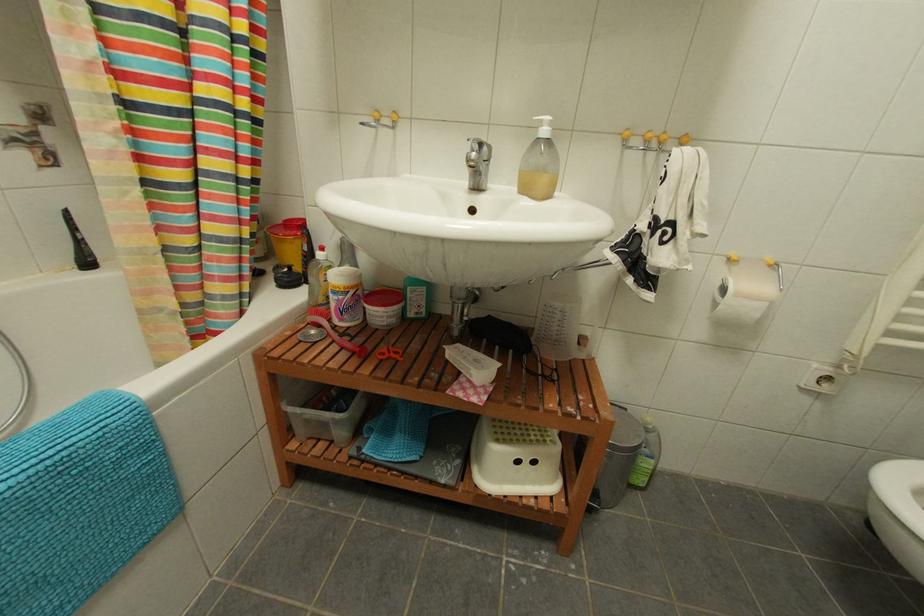
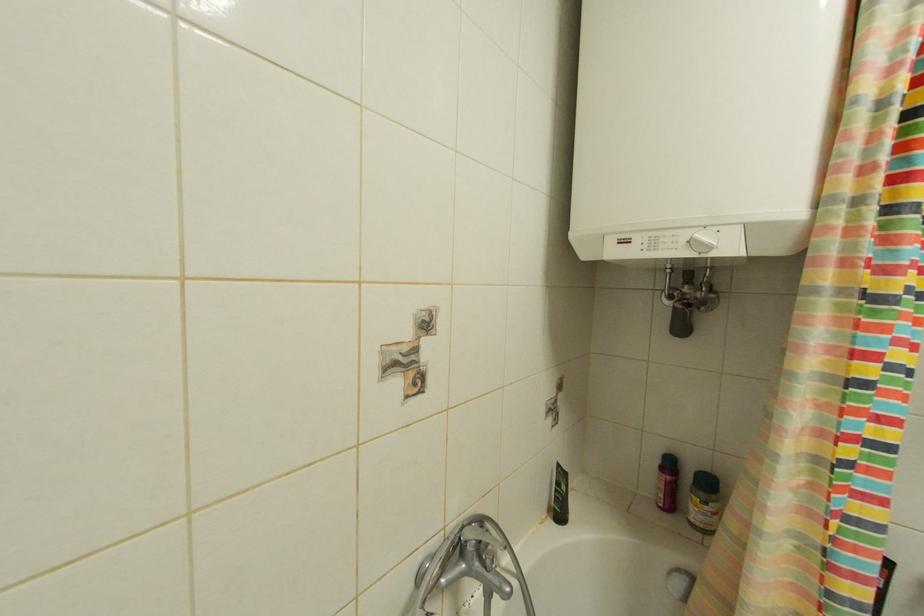
The images are taken continuously from a first-person perspective. In which direction is your viewpoint rotating?

The camera rotated toward left-up.